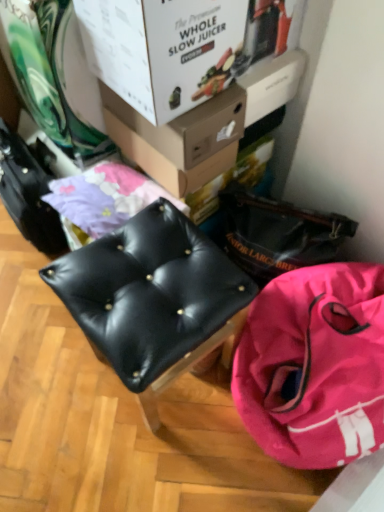
Question: Does pink fabric bag at lower right have a greater height compared to white cardboard box at upper center, which is the second box from back to front?

Choices:
 (A) no
 (B) yes

Answer: (B)

Question: Can you confirm if pink fabric bag at lower right is shorter than white cardboard box at upper center, placed as the 1th box when sorted from front to back?

Choices:
 (A) no
 (B) yes

Answer: (A)

Question: Is pink fabric bag at lower right at the left side of white cardboard box at upper center, placed as the 1th box when sorted from front to back?

Choices:
 (A) no
 (B) yes

Answer: (A)

Question: Is pink fabric bag at lower right next to white cardboard box at upper center, placed as the 1th box when sorted from front to back, and touching it?

Choices:
 (A) no
 (B) yes

Answer: (A)

Question: From a real-world perspective, is pink fabric bag at lower right physically below white cardboard box at upper center, placed as the 1th box when sorted from front to back?

Choices:
 (A) no
 (B) yes

Answer: (B)

Question: Is white cardboard box at upper center, which is the second box from back to front, situated inside matte cardboard box at upper center, acting as the second box starting from the front, or outside?

Choices:
 (A) outside
 (B) inside

Answer: (A)

Question: Visually, is white cardboard box at upper center, placed as the 1th box when sorted from front to back, positioned to the left or to the right of matte cardboard box at upper center, marked as the 1th box in a back-to-front arrangement?

Choices:
 (A) left
 (B) right

Answer: (A)

Question: Is white cardboard box at upper center, placed as the 1th box when sorted from front to back, bigger or smaller than matte cardboard box at upper center, marked as the 1th box in a back-to-front arrangement?

Choices:
 (A) small
 (B) big

Answer: (B)

Question: Considering the positions of white cardboard box at upper center, which is the second box from back to front, and matte cardboard box at upper center, acting as the second box starting from the front, in the image, is white cardboard box at upper center, which is the second box from back to front, wider or thinner than matte cardboard box at upper center, acting as the second box starting from the front,?

Choices:
 (A) wide
 (B) thin

Answer: (A)

Question: Looking at the image, does matte cardboard box at upper center, marked as the 1th box in a back-to-front arrangement, seem bigger or smaller compared to pink fabric bag at lower right?

Choices:
 (A) big
 (B) small

Answer: (B)

Question: Considering the relative positions of matte cardboard box at upper center, acting as the second box starting from the front, and pink fabric bag at lower right in the image provided, is matte cardboard box at upper center, acting as the second box starting from the front, to the left or to the right of pink fabric bag at lower right?

Choices:
 (A) right
 (B) left

Answer: (B)

Question: Is matte cardboard box at upper center, acting as the second box starting from the front, in front of or behind pink fabric bag at lower right in the image?

Choices:
 (A) front
 (B) behind

Answer: (B)

Question: From the image's perspective, is matte cardboard box at upper center, marked as the 1th box in a back-to-front arrangement, positioned above or below pink fabric bag at lower right?

Choices:
 (A) above
 (B) below

Answer: (A)

Question: From their relative heights in the image, would you say matte cardboard box at upper center, marked as the 1th box in a back-to-front arrangement, is taller or shorter than white cardboard box at upper center, placed as the 1th box when sorted from front to back?

Choices:
 (A) tall
 (B) short

Answer: (B)

Question: From the image's perspective, is matte cardboard box at upper center, marked as the 1th box in a back-to-front arrangement, above or below white cardboard box at upper center, which is the second box from back to front?

Choices:
 (A) above
 (B) below

Answer: (B)